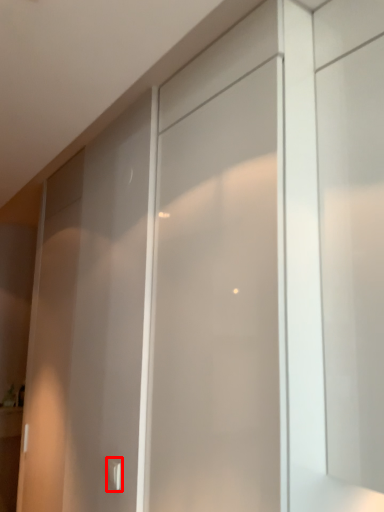
Question: From the image, what is the correct spatial relationship of door handle (annotated by the red box) in relation to screen door?

Choices:
 (A) right
 (B) left

Answer: (B)